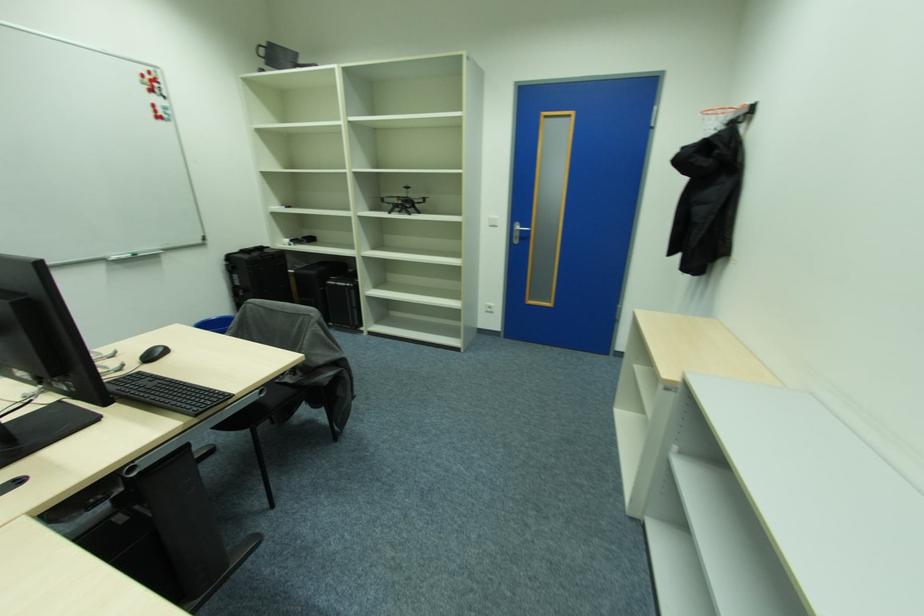
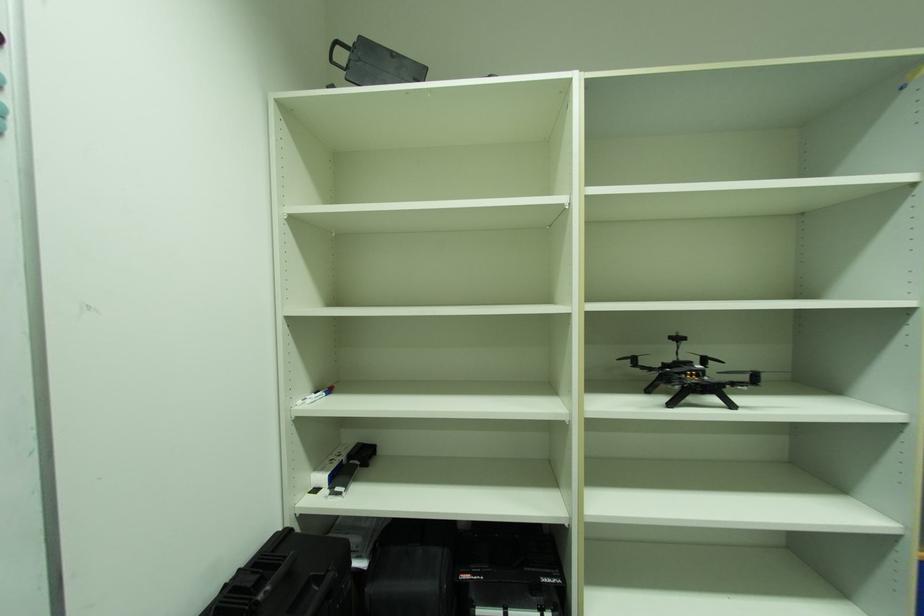
The images are taken continuously from a first-person perspective. In which direction are you moving?

The cameraman moved toward left, forward.